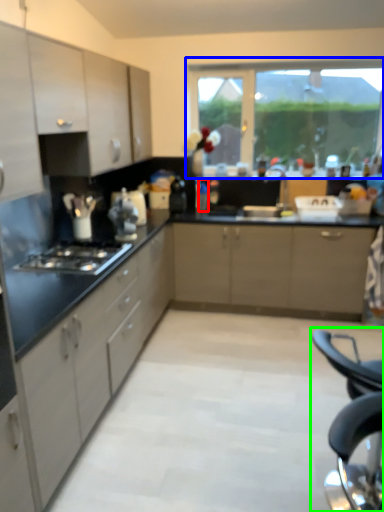
Question: Based on their relative distances, which object is farther from bottle (highlighted by a red box)? Choose from window (highlighted by a blue box) and folding chair (highlighted by a green box).

Choices:
 (A) window
 (B) folding chair

Answer: (B)